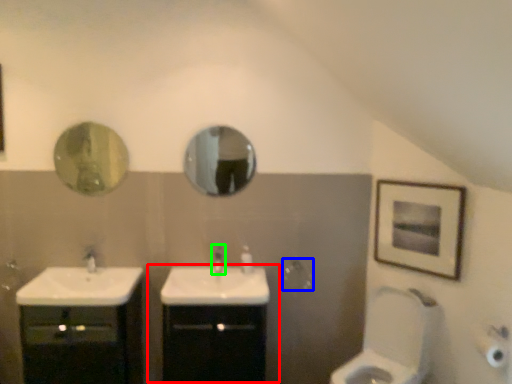
Question: Based on their relative distances, which object is nearer to bathroom cabinet (highlighted by a red box)? Choose from towel bar (highlighted by a blue box) and tap (highlighted by a green box).

Choices:
 (A) towel bar
 (B) tap

Answer: (B)